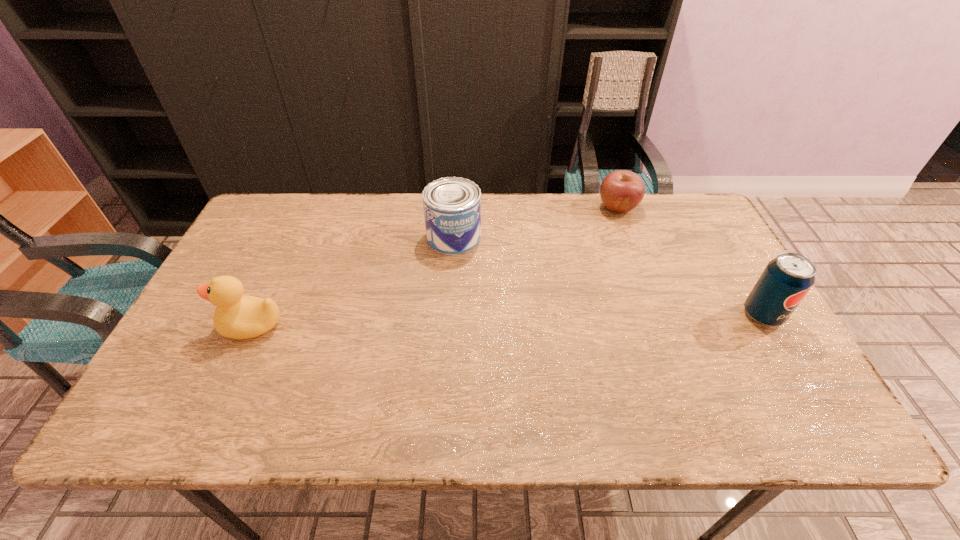
The image size is (960, 540). Find the location of `vacant space at the right edge`. vacant space at the right edge is located at coordinates click(x=732, y=346).

Locate an element on the screen. This screenshot has width=960, height=540. free space at the near left corner of the desktop is located at coordinates (181, 367).

Where is `free point between the duck and the shortest object`? This screenshot has width=960, height=540. free point between the duck and the shortest object is located at coordinates (435, 266).

Locate an element on the screen. empty space that is in between the leftmost object and the can is located at coordinates (353, 281).

The image size is (960, 540). What are the coordinates of `free space between the second object from left to right and the shortest object` in the screenshot? It's located at (536, 222).

I want to click on free area in between the duck and the shortest object, so click(435, 266).

At what (x,y) coordinates should I click in order to perform the action: click on vacant area between the can and the farthest object. Please return your answer as a coordinate pair (x, y). This screenshot has height=540, width=960. Looking at the image, I should click on (536, 222).

Locate an element on the screen. The width and height of the screenshot is (960, 540). empty space between the second object from left to right and the leftmost object is located at coordinates (353, 281).

I want to click on vacant space that is in between the second farthest object and the third object from left to right, so click(536, 222).

Where is `vacant area between the apple and the rightmost object`? vacant area between the apple and the rightmost object is located at coordinates (690, 261).